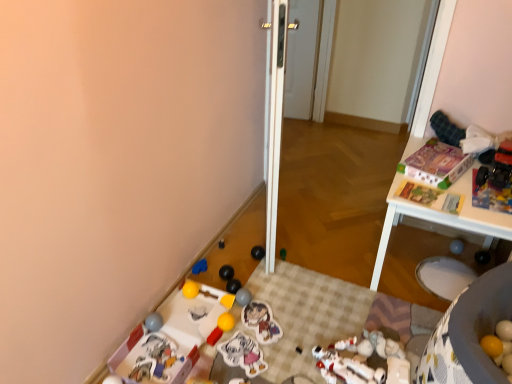
Where is `vacant area that lies between yellow matte toy at lower center, acting as the 12th toy starting from the right, and matte plastic sticker at center, placed as the 11th toy when sorted from left to right`? The image size is (512, 384). vacant area that lies between yellow matte toy at lower center, acting as the 12th toy starting from the right, and matte plastic sticker at center, placed as the 11th toy when sorted from left to right is located at coordinates (234, 327).